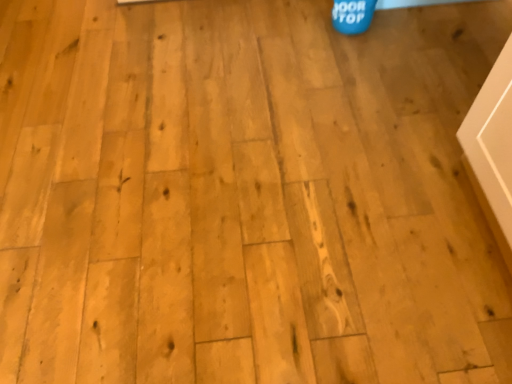
In order to face blue rubber door stop at upper right, should I rotate leftwards or rightwards?

To align with it, rotate right about 12.560°.

Image resolution: width=512 pixels, height=384 pixels. What do you see at coordinates (352, 15) in the screenshot?
I see `blue rubber door stop at upper right` at bounding box center [352, 15].

Find the location of a particular element. blue rubber door stop at upper right is located at coordinates [352, 15].

You are a GUI agent. You are given a task and a screenshot of the screen. Output one action in this format:
    pyautogui.click(x=<x>, y=<y>)
    Task: Click on the blue rubber door stop at upper right
    
    Given the screenshot: What is the action you would take?
    pyautogui.click(x=352, y=15)